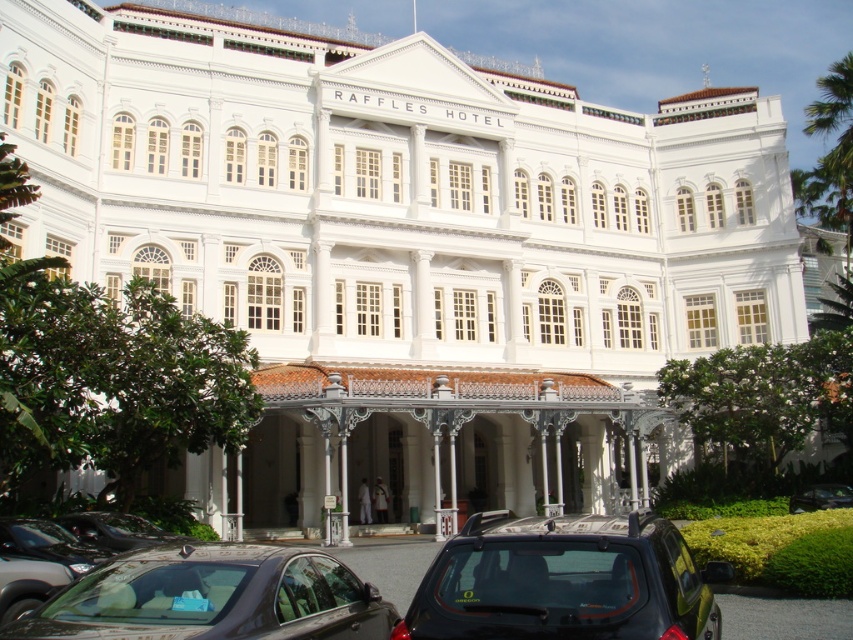
Question: Observing the image, what is the correct spatial positioning of black matte car at lower center in reference to shiny black sedan at lower center?

Choices:
 (A) above
 (B) below

Answer: (B)

Question: Does shiny black sedan at lower center appear over metallic silver car at lower center?

Choices:
 (A) yes
 (B) no

Answer: (A)

Question: Which of the following is the farthest from the observer?

Choices:
 (A) (805, 493)
 (B) (456, 577)
 (C) (325, 573)
 (D) (22, 529)

Answer: (A)

Question: Among these points, which one is nearest to the camera?

Choices:
 (A) (100, 524)
 (B) (804, 508)
 (C) (160, 556)
 (D) (604, 596)

Answer: (D)

Question: Is black matte car at lower center positioned in front of shiny black sedan at lower center?

Choices:
 (A) no
 (B) yes

Answer: (A)

Question: Which point is farther from the camera taking this photo?

Choices:
 (A) (283, 604)
 (B) (39, 600)
 (C) (799, 492)

Answer: (C)